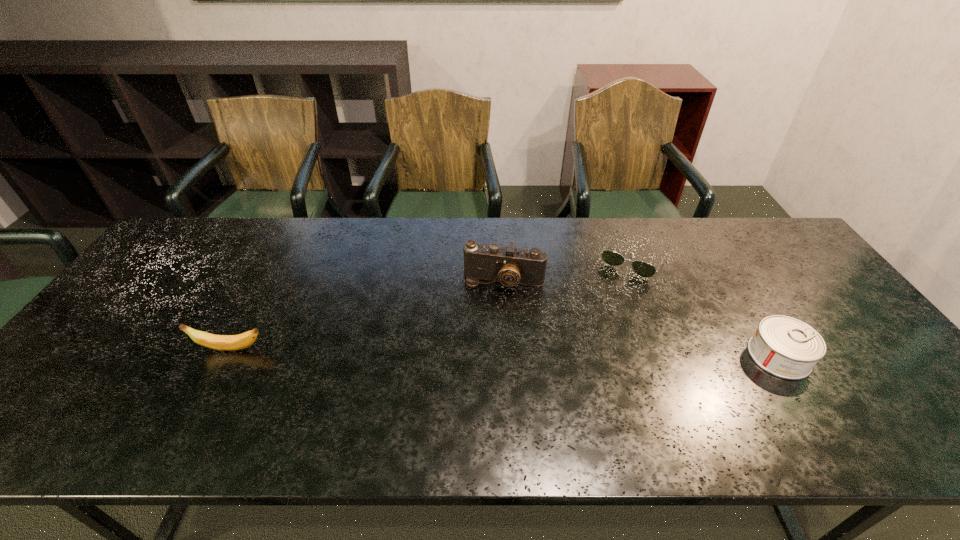
What are the coordinates of `free point between the second object from left to right and the can` in the screenshot? It's located at (641, 319).

I want to click on empty space between the shortest object and the can, so click(x=707, y=307).

Where is `free space between the can and the tallest object`? free space between the can and the tallest object is located at coordinates (641, 319).

Locate an element on the screen. unoccupied position between the shortest object and the banana is located at coordinates (432, 303).

Identify the location of empty location between the sunglasses and the leftmost object. The height and width of the screenshot is (540, 960). 432,303.

Locate an element on the screen. This screenshot has width=960, height=540. free area in between the can and the sunglasses is located at coordinates (707, 307).

Find the location of a particular element. The height and width of the screenshot is (540, 960). the third closest object relative to the sunglasses is located at coordinates (217, 342).

Image resolution: width=960 pixels, height=540 pixels. I want to click on the second closest object to the second shortest object, so click(x=510, y=266).

I want to click on free point that satisfies the following two spatial constraints: 1. on the front side of the second object from right to left; 2. on the right side of the rightmost object, so (674, 356).

Find the location of a particular element. The width and height of the screenshot is (960, 540). free location that satisfies the following two spatial constraints: 1. on the front side of the third object from left to right; 2. on the right side of the rightmost object is located at coordinates (674, 356).